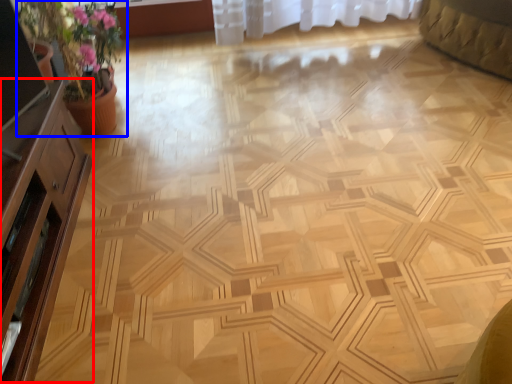
Question: Which object appears closest to the camera in this image, dresser (highlighted by a red box) or houseplant (highlighted by a blue box)?

Choices:
 (A) dresser
 (B) houseplant

Answer: (A)